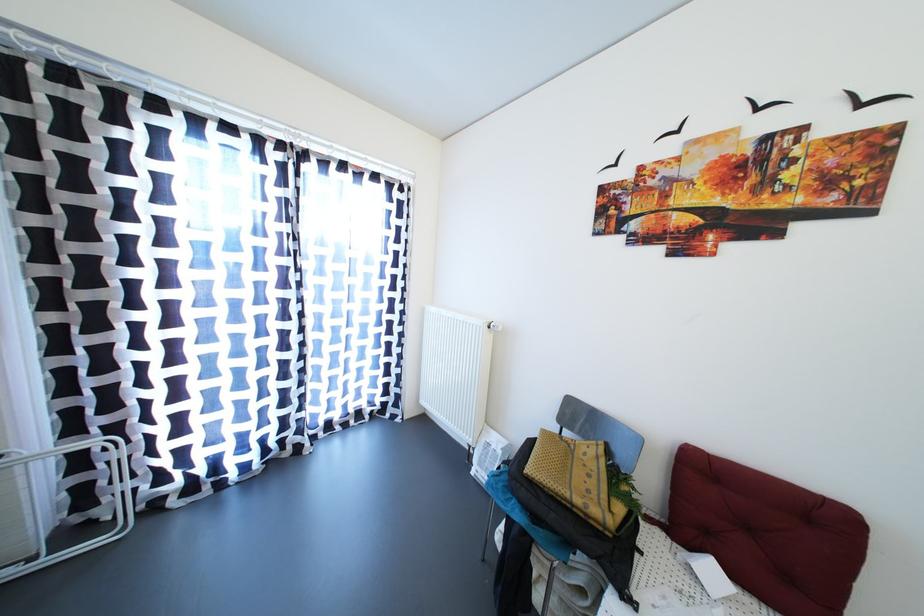
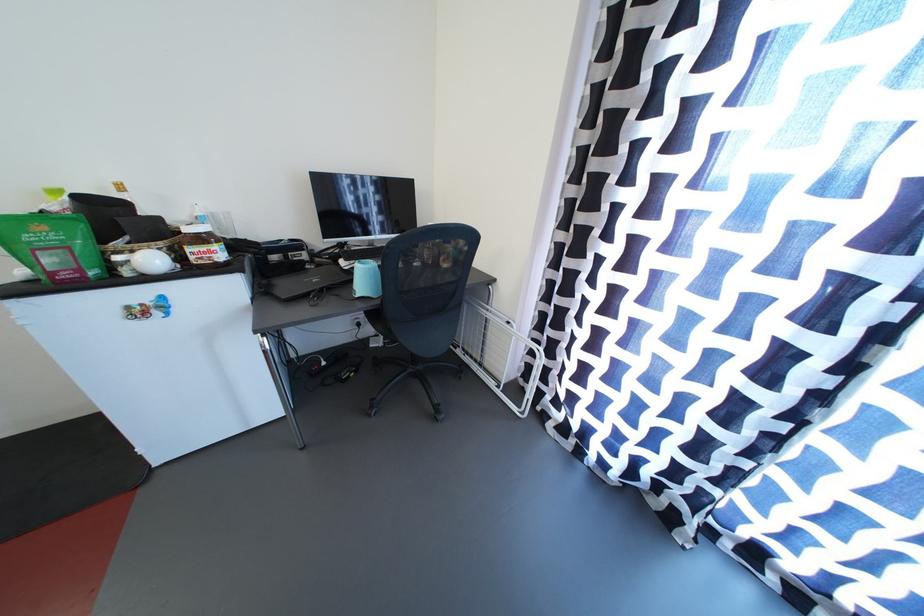
Locate, in the second image, the point that corresponds to (x=49, y=567) in the first image.

(505, 397)